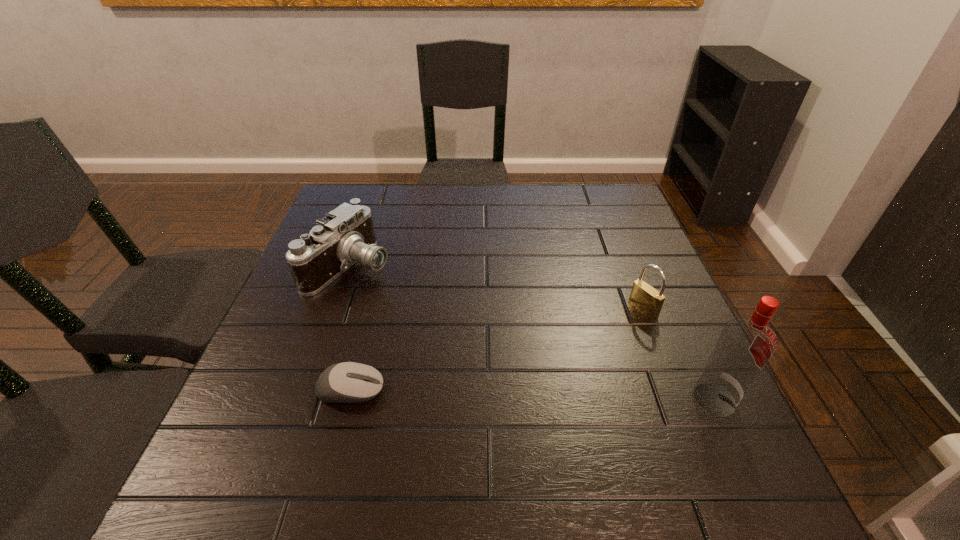
Locate an element on the screen. This screenshot has width=960, height=540. empty space that is in between the vodka and the camera is located at coordinates (533, 332).

Locate an element on the screen. The width and height of the screenshot is (960, 540). vacant area between the padlock and the computer equipment is located at coordinates (497, 349).

This screenshot has width=960, height=540. What are the coordinates of `empty space that is in between the second object from right to left and the computer equipment` in the screenshot? It's located at (497, 349).

I want to click on empty space that is in between the camera and the computer equipment, so click(x=350, y=328).

At what (x,y) coordinates should I click in order to perform the action: click on vacant region between the shortest object and the rightmost object. Please return your answer as a coordinate pair (x, y). Looking at the image, I should click on (533, 394).

I want to click on free space between the padlock and the rightmost object, so click(679, 354).

The width and height of the screenshot is (960, 540). In order to click on vacant area between the third nearest object and the farthest object in this screenshot , I will do `click(496, 288)`.

Choose which object is the nearest neighbor to the shortest object. Please provide its 2D coordinates. Your answer should be formatted as a tuple, i.e. [(x, y)], where the tuple contains the x and y coordinates of a point satisfying the conditions above.

[(346, 235)]

This screenshot has width=960, height=540. In order to click on object that is the second closest to the shortest object in this screenshot , I will do `click(646, 299)`.

This screenshot has width=960, height=540. I want to click on free point that satisfies the following two spatial constraints: 1. on the front side of the farthest object; 2. on the wheel side of the shortest object, so click(307, 390).